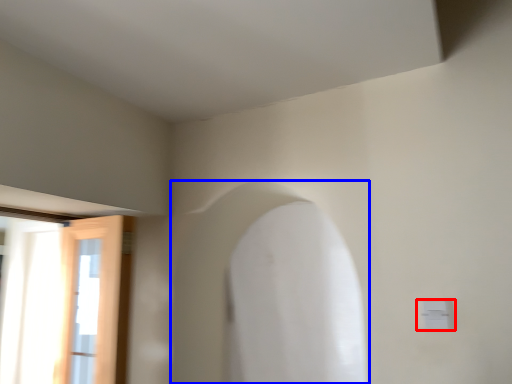
Question: Which object is further to the camera taking this photo, electric outlet (highlighted by a red box) or archway (highlighted by a blue box)?

Choices:
 (A) electric outlet
 (B) archway

Answer: (B)